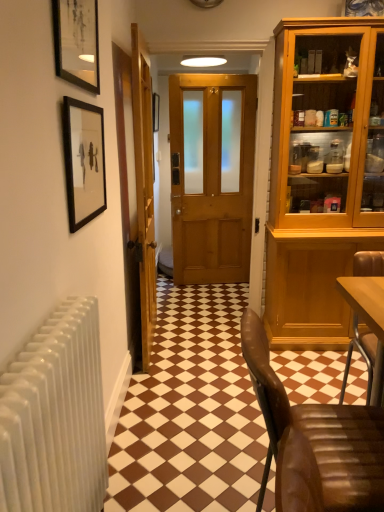
Image resolution: width=384 pixels, height=512 pixels. Identify the location of free location in front of wooden door at center, the 1th door from the right. (206, 337).